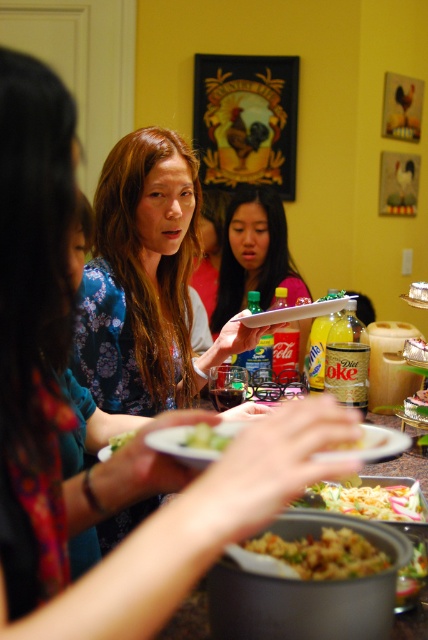
Can you confirm if shiny metallic bowl at center is positioned above green leafy vegetable at center?

No.

Who is positioned more to the left, shiny metallic bowl at center or green leafy vegetable at center?

Positioned to the left is green leafy vegetable at center.

Does point (329, 488) come in front of point (216, 444)?

No, (329, 488) is behind (216, 444).

At what (x,y) coordinates should I click in order to perform the action: click on shiny metallic bowl at center. Please return your answer as a coordinate pair (x, y). The width and height of the screenshot is (428, 640). Looking at the image, I should click on (366, 500).

Which is above, shiny metallic bowl at center or shiny metallic spoon at center?

shiny metallic bowl at center is above.

Which is more to the right, shiny metallic bowl at center or shiny metallic spoon at center?

shiny metallic spoon at center

The image size is (428, 640). Find the location of `shiny metallic bowl at center`. shiny metallic bowl at center is located at coordinates (366, 500).

Who is more forward, (297, 552) or (109, 444)?

Point (297, 552)

Does brown rice at center have a lesser width compared to green leafy salad at center?

No, brown rice at center is not thinner than green leafy salad at center.

Between point (374, 568) and point (124, 440), which one is positioned behind?

The point (124, 440) is more distant.

Where is `brown rice at center`? Image resolution: width=428 pixels, height=640 pixels. brown rice at center is located at coordinates [317, 556].